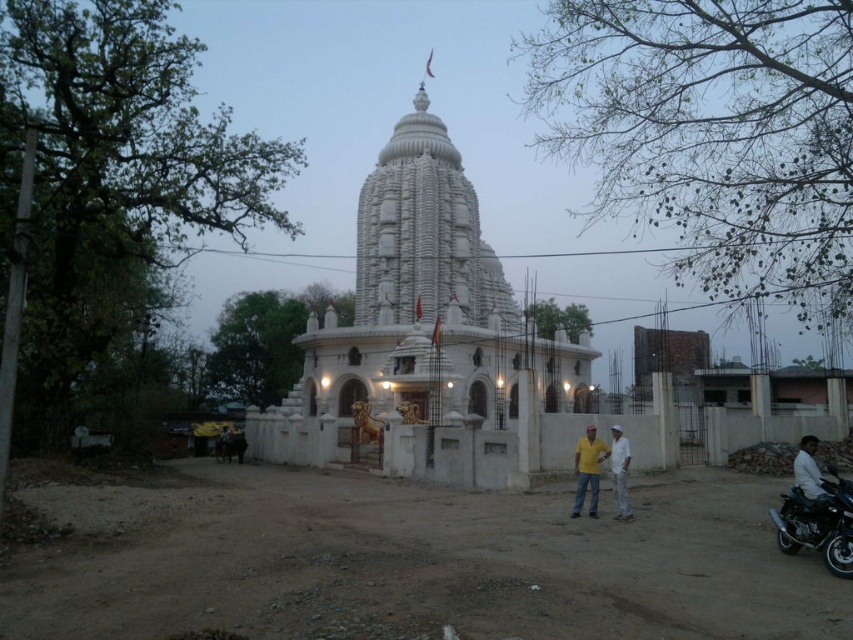
Between brown dirt field at center and shiny black motorcycle at lower right, which one has more height?

With more height is shiny black motorcycle at lower right.

Does brown dirt field at center have a greater width compared to shiny black motorcycle at lower right?

Yes.

Does point (444, 588) come closer to viewer compared to point (830, 512)?

Yes, it is.

Where is `brown dirt field at center`? The width and height of the screenshot is (853, 640). brown dirt field at center is located at coordinates (434, 566).

This screenshot has width=853, height=640. I want to click on brown dirt field at center, so [x=434, y=566].

Which is behind, point (595, 502) or point (627, 445)?

Positioned behind is point (627, 445).

You are a GUI agent. You are given a task and a screenshot of the screen. Output one action in this format:
    pyautogui.click(x=<x>, y=<y>)
    Task: Click on the yellow cotton shirt at center
    This screenshot has width=853, height=640.
    Given the screenshot: What is the action you would take?
    pyautogui.click(x=589, y=470)

This screenshot has height=640, width=853. I want to click on yellow cotton shirt at center, so click(x=589, y=470).